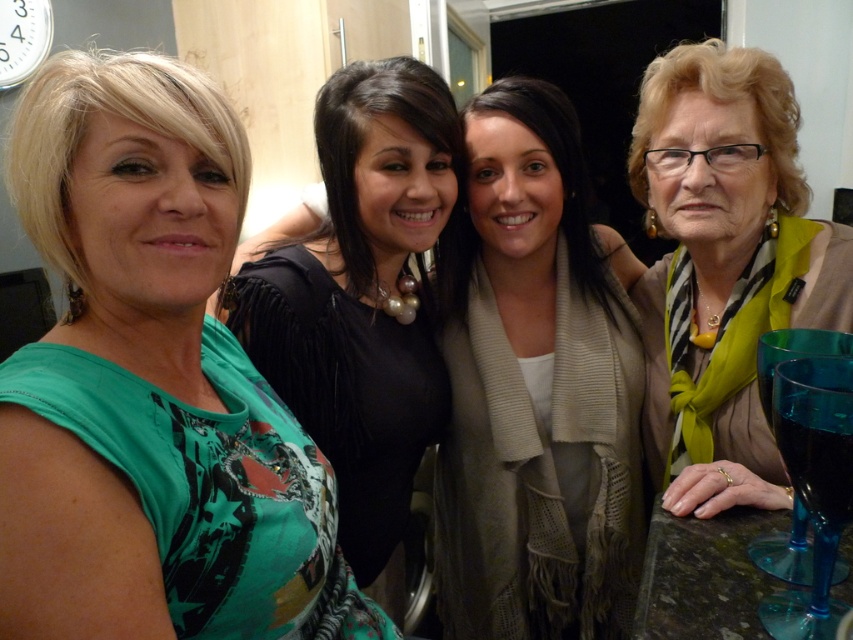
You are a photographer standing at the camera position. You want to adjust the focus so that the light beige scarf at center is in sharp focus. If your camera has a depth of field that can cover 3 feet, will the scarf be in focus if you focus on an object 4 feet away?

The light beige scarf at center is 4.14 feet away from the camera. If you focus on an object 4 feet away, the depth of field covers 3 feet, so the total range from 3.5 to 4.5 feet would be in focus. Since 4.14 is within this range, the scarf will be in focus.

Based on the photo, you are a photographer trying to adjust the lighting for a group photo. You notice the green printed dress at left and the light beige scarf at center. Which object is shorter in height?

The green printed dress at left is not as tall as the light beige scarf at center, so the green printed dress at left is shorter in height.